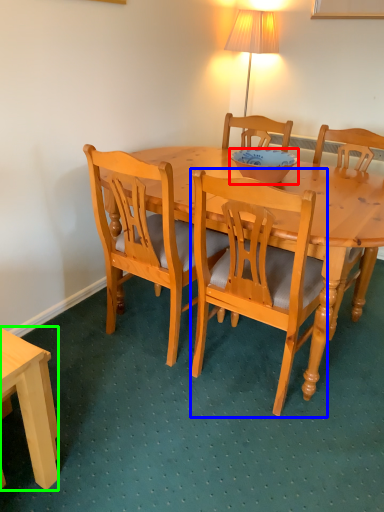
Question: Estimate the real-world distances between objects in this image. Which object is farther from bowl (highlighted by a red box), chair (highlighted by a blue box) or desk (highlighted by a green box)?

Choices:
 (A) chair
 (B) desk

Answer: (B)